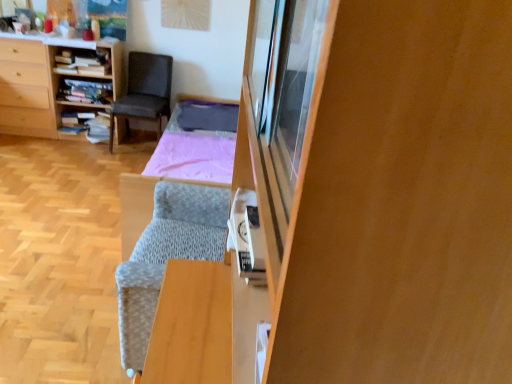
Question: Is wooden bookshelf at center, which is counted as the second shelf, starting from the top, wider or thinner than wooden bookshelf at upper left, the 1th shelf from the top?

Choices:
 (A) thin
 (B) wide

Answer: (B)

Question: Based on their positions, is wooden bookshelf at center, acting as the 2th shelf starting from the bottom, located to the left or right of wooden bookshelf at upper left, the 1th shelf from the top?

Choices:
 (A) left
 (B) right

Answer: (A)

Question: Considering the real-world distances, which object is closest to the wooden bookshelf at left?

Choices:
 (A) textured gray bed frame at center
 (B) wooden bookshelf at center, which is counted as the second shelf, starting from the top
 (C) wooden bookshelf at left, acting as the 1th shelf starting from the bottom
 (D) dark gray fabric chair at upper left
 (E) wooden bookshelf at upper left, which is the 3th shelf in bottom-to-top order

Answer: (B)

Question: Which of these objects is positioned closest to the wooden bookshelf at left, acting as the 1th shelf starting from the bottom?

Choices:
 (A) wooden bookshelf at upper left, the 1th shelf from the top
 (B) textured gray bed frame at center
 (C) wooden cabinet at right
 (D) dark gray fabric chair at upper left
 (E) wooden bookshelf at left

Answer: (E)